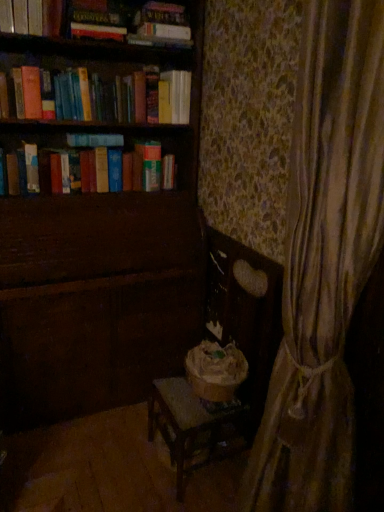
Question: Does wooden rocking chair at center appear on the left side of hardcover book at upper center, placed as the second paperback book when sorted from right to left?

Choices:
 (A) yes
 (B) no

Answer: (B)

Question: Is wooden rocking chair at center thinner than hardcover book at upper center, which ranks as the 2th paperback book in bottom-to-top order?

Choices:
 (A) yes
 (B) no

Answer: (B)

Question: Is wooden rocking chair at center facing towards hardcover book at upper center, marked as the second paperback book in a top-to-bottom arrangement?

Choices:
 (A) no
 (B) yes

Answer: (A)

Question: Can you confirm if wooden rocking chair at center is smaller than hardcover book at upper center, which ranks as the 2th paperback book in bottom-to-top order?

Choices:
 (A) no
 (B) yes

Answer: (A)

Question: From a real-world perspective, is wooden rocking chair at center positioned under hardcover book at upper center, marked as the second paperback book in a top-to-bottom arrangement, based on gravity?

Choices:
 (A) yes
 (B) no

Answer: (A)

Question: In the image, is hardcover book at upper center, which ranks as the 3th paperback book in left-to-right order, positioned in front of or behind wooden rocking chair at center?

Choices:
 (A) behind
 (B) front

Answer: (A)

Question: From a real-world perspective, is hardcover book at upper center, the 3th paperback book when ordered from bottom to top, physically located above or below wooden rocking chair at center?

Choices:
 (A) above
 (B) below

Answer: (A)

Question: In terms of width, does hardcover book at upper center, marked as the 1th paperback book in a top-to-bottom arrangement, look wider or thinner when compared to wooden rocking chair at center?

Choices:
 (A) wide
 (B) thin

Answer: (B)

Question: Is hardcover book at upper center, the 3th paperback book when ordered from bottom to top, to the left or to the right of wooden rocking chair at center in the image?

Choices:
 (A) right
 (B) left

Answer: (B)

Question: Is hardcover book at upper center, the 2th paperback book in the left-to-right sequence, in front of or behind hardcover book at left, which is the third paperback book in right-to-left order, in the image?

Choices:
 (A) front
 (B) behind

Answer: (A)

Question: In terms of width, does hardcover book at upper center, marked as the second paperback book in a top-to-bottom arrangement, look wider or thinner when compared to hardcover book at left, placed as the 1th paperback book when sorted from bottom to top?

Choices:
 (A) thin
 (B) wide

Answer: (B)

Question: From the image's perspective, relative to hardcover book at left, placed as the 1th paperback book when sorted from bottom to top, is hardcover book at upper center, which ranks as the 2th paperback book in bottom-to-top order, above or below?

Choices:
 (A) below
 (B) above

Answer: (B)

Question: Is hardcover book at upper center, the 2th paperback book in the left-to-right sequence, bigger or smaller than hardcover book at left, which is the third paperback book in right-to-left order?

Choices:
 (A) big
 (B) small

Answer: (A)

Question: Considering the relative positions of wooden chair at lower center and hardcover book at upper left in the image provided, is wooden chair at lower center to the left or to the right of hardcover book at upper left?

Choices:
 (A) left
 (B) right

Answer: (B)

Question: From their relative heights in the image, would you say wooden chair at lower center is taller or shorter than hardcover book at upper left?

Choices:
 (A) tall
 (B) short

Answer: (A)